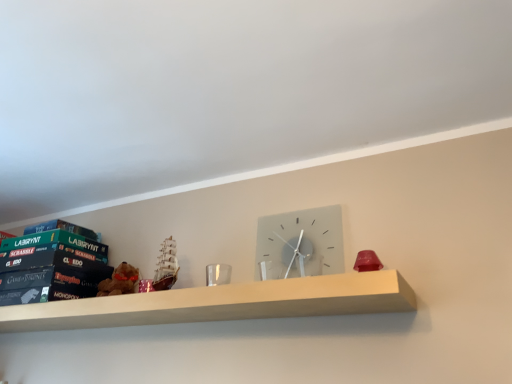
Question: Is wooden shelf at center positioned with its back to green matte board game box at left, positioned as the 2th paperback book in top-to-bottom order?

Choices:
 (A) no
 (B) yes

Answer: (A)

Question: Does wooden shelf at center appear on the right side of green matte board game box at left, positioned as the 2th paperback book in top-to-bottom order?

Choices:
 (A) no
 (B) yes

Answer: (B)

Question: Does wooden shelf at center have a lesser width compared to green matte board game box at left, which appears as the second paperback book when ordered from the bottom?

Choices:
 (A) no
 (B) yes

Answer: (A)

Question: Can you confirm if wooden shelf at center is shorter than green matte board game box at left, which appears as the second paperback book when ordered from the bottom?

Choices:
 (A) yes
 (B) no

Answer: (B)

Question: From a real-world perspective, is wooden shelf at center physically above green matte board game box at left, positioned as the 2th paperback book in top-to-bottom order?

Choices:
 (A) no
 (B) yes

Answer: (A)

Question: From the image's perspective, does wooden shelf at center appear lower than green matte board game box at left, positioned as the 2th paperback book in top-to-bottom order?

Choices:
 (A) yes
 (B) no

Answer: (A)

Question: From the image's perspective, is wooden shelf at center located beneath satin gray clock at center?

Choices:
 (A) yes
 (B) no

Answer: (A)

Question: Is wooden shelf at center taller than satin gray clock at center?

Choices:
 (A) no
 (B) yes

Answer: (A)

Question: Is wooden shelf at center aimed at satin gray clock at center?

Choices:
 (A) no
 (B) yes

Answer: (A)

Question: Is wooden shelf at center outside of satin gray clock at center?

Choices:
 (A) no
 (B) yes

Answer: (B)

Question: Can you confirm if wooden shelf at center is positioned to the right of satin gray clock at center?

Choices:
 (A) no
 (B) yes

Answer: (A)

Question: Is wooden shelf at center thinner than satin gray clock at center?

Choices:
 (A) yes
 (B) no

Answer: (B)

Question: From a real-world perspective, is wooden shelf at center on hardcover book at left, positioned as the third paperback book in top-to-bottom order?

Choices:
 (A) no
 (B) yes

Answer: (A)